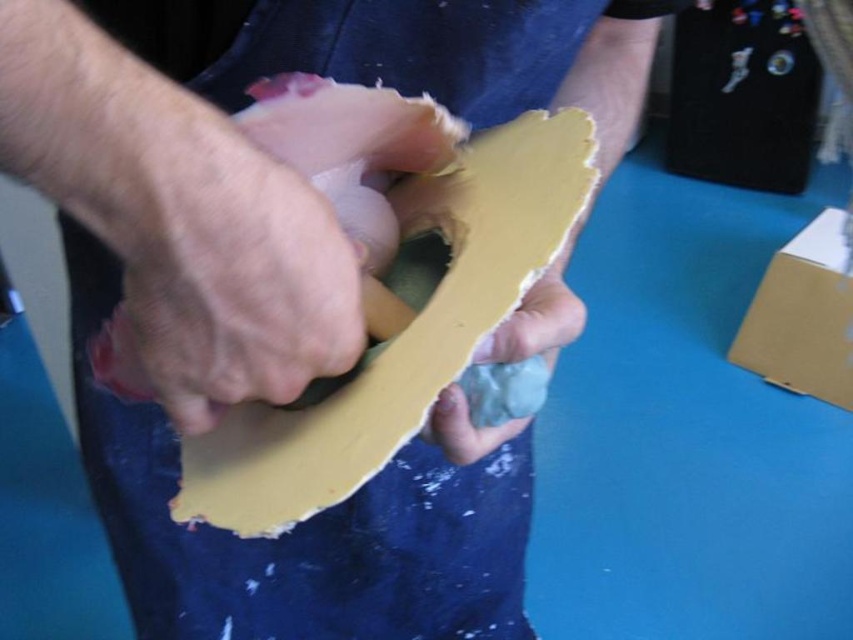
Question: Is matte cardboard box at lower right thinner than matte yellow sandpaper at center?

Choices:
 (A) yes
 (B) no

Answer: (B)

Question: Which point is farther from the camera taking this photo?

Choices:
 (A) (813, 394)
 (B) (439, 404)

Answer: (A)

Question: Which point is closer to the camera taking this photo?

Choices:
 (A) (837, 384)
 (B) (515, 317)

Answer: (B)

Question: Which point is closer to the camera?

Choices:
 (A) matte yellow sandpaper at center
 (B) matte cardboard box at lower right
 (C) matte yellow paper at center

Answer: (A)

Question: Does matte cardboard box at lower right have a larger size compared to matte yellow paper at center?

Choices:
 (A) yes
 (B) no

Answer: (A)

Question: From the image, what is the correct spatial relationship of matte cardboard box at lower right in relation to matte yellow sandpaper at center?

Choices:
 (A) right
 (B) left

Answer: (A)